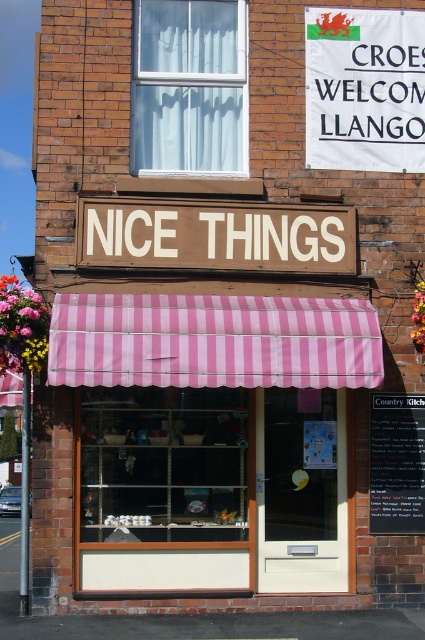
Question: Among these objects, which one is nearest to the camera?

Choices:
 (A) black chalkboard at lower right
 (B) white sheer curtain at upper center
 (C) white fabric banner at upper center

Answer: (A)

Question: Is white fabric banner at upper center to the right of black chalkboard at lower right from the viewer's perspective?

Choices:
 (A) no
 (B) yes

Answer: (A)

Question: Is white sheer curtain at upper center wider than black chalkboard at lower right?

Choices:
 (A) yes
 (B) no

Answer: (A)

Question: Which of the following is the closest to the observer?

Choices:
 (A) white fabric banner at upper center
 (B) black chalkboard at lower right
 (C) white sheer curtain at upper center

Answer: (B)

Question: Observing the image, what is the correct spatial positioning of white sheer curtain at upper center in reference to white fabric banner at upper center?

Choices:
 (A) right
 (B) left

Answer: (B)

Question: Which object is closer to the camera taking this photo?

Choices:
 (A) black chalkboard at lower right
 (B) white fabric banner at upper center

Answer: (A)